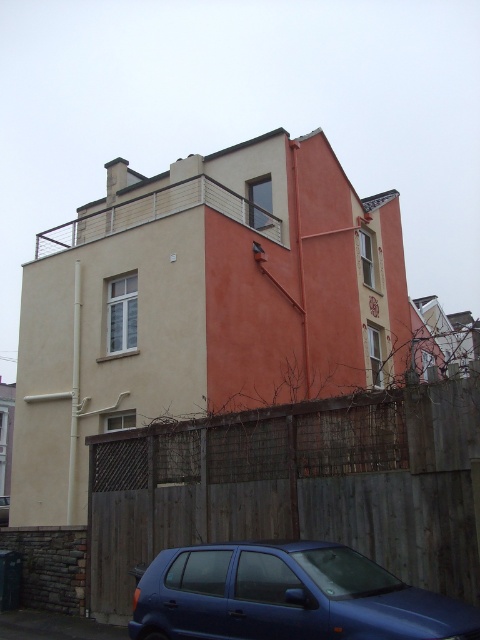
Question: Does matte blue hatchback at lower center have a smaller size compared to blue matte car at lower center?

Choices:
 (A) no
 (B) yes

Answer: (B)

Question: Considering the real-world distances, which object is closest to the matte blue hatchback at lower center?

Choices:
 (A) wooden fence at lower center
 (B) blue matte car at lower center

Answer: (A)

Question: Which point is farther to the camera?

Choices:
 (A) (8, 515)
 (B) (244, 632)
 (C) (410, 416)

Answer: (A)

Question: Can you confirm if matte blue hatchback at lower center is positioned above blue matte car at lower center?

Choices:
 (A) yes
 (B) no

Answer: (A)

Question: Does wooden fence at lower center appear under blue matte car at lower center?

Choices:
 (A) yes
 (B) no

Answer: (B)

Question: Estimate the real-world distances between objects in this image. Which object is farther from the wooden fence at lower center?

Choices:
 (A) matte blue hatchback at lower center
 (B) blue matte car at lower center

Answer: (B)